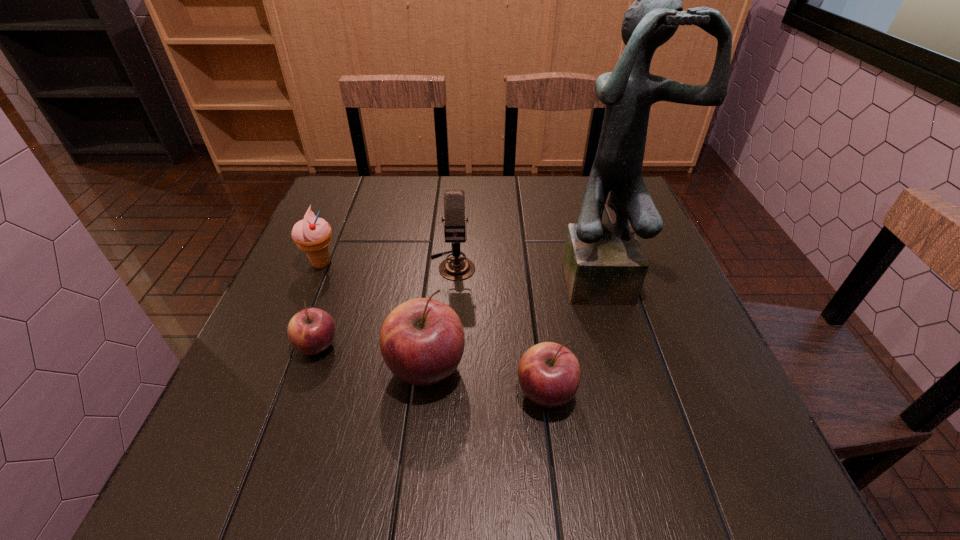
The image size is (960, 540). I want to click on the second closest object to the tallest apple, so point(311,331).

At what (x,y) coordinates should I click in order to perform the action: click on object that is the closest to the tallest apple. Please return your answer as a coordinate pair (x, y). The width and height of the screenshot is (960, 540). Looking at the image, I should click on (549, 374).

Select which apple appears as the second closest to the microphone. Please provide its 2D coordinates. Your answer should be formatted as a tuple, i.e. [(x, y)], where the tuple contains the x and y coordinates of a point satisfying the conditions above.

[(311, 331)]

Image resolution: width=960 pixels, height=540 pixels. In order to click on the second closest apple to the icecream in this screenshot , I will do `click(422, 340)`.

Identify the location of vacant space that satisfies the following two spatial constraints: 1. on the front side of the rightmost apple; 2. on the right side of the shortest object. (301, 393).

The width and height of the screenshot is (960, 540). I want to click on vacant point that satisfies the following two spatial constraints: 1. on the front-facing side of the fifth object from left to right; 2. on the left side of the microphone, so click(444, 393).

At what (x,y) coordinates should I click in order to perform the action: click on free spot that satisfies the following two spatial constraints: 1. on the front-facing side of the microphone; 2. on the left side of the rightmost apple. Please return your answer as a coordinate pair (x, y). The height and width of the screenshot is (540, 960). Looking at the image, I should click on (444, 393).